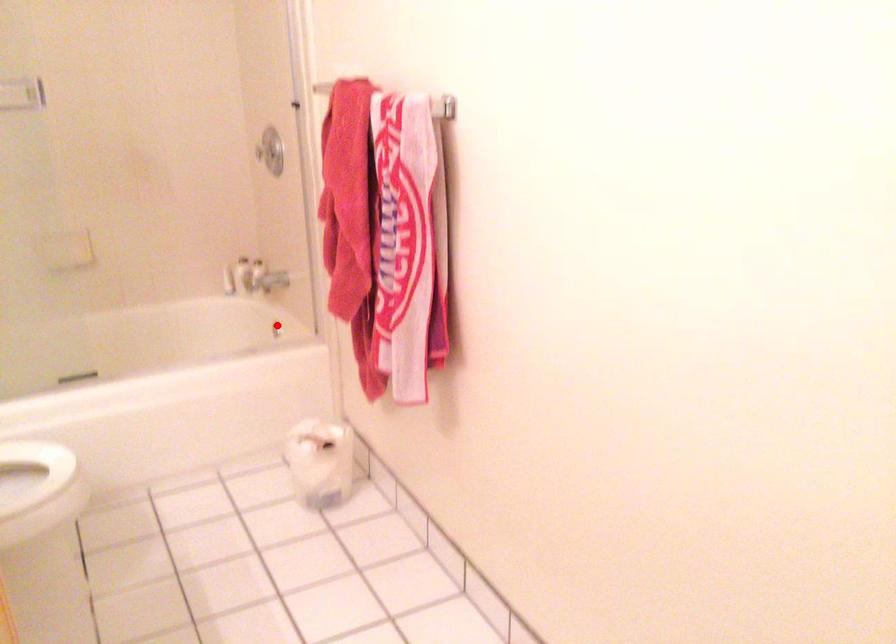
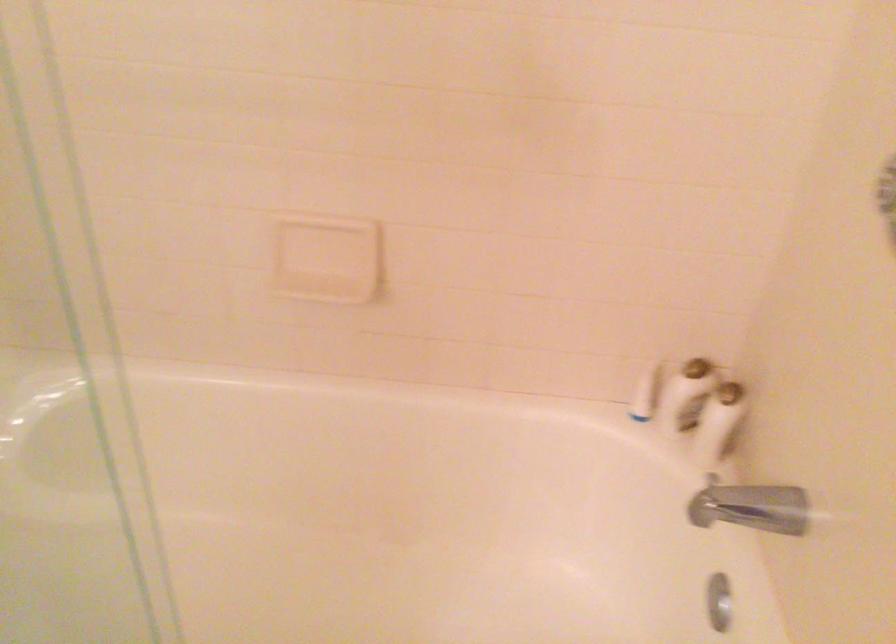
Question: I am providing you with two images of the same scene from different viewpoints. Image1 has a red point marked. In image2, the corresponding 3D location appears at what relative position? Reply with the corresponding letter.

Choices:
 (A) Closer
 (B) Farther

Answer: (A)